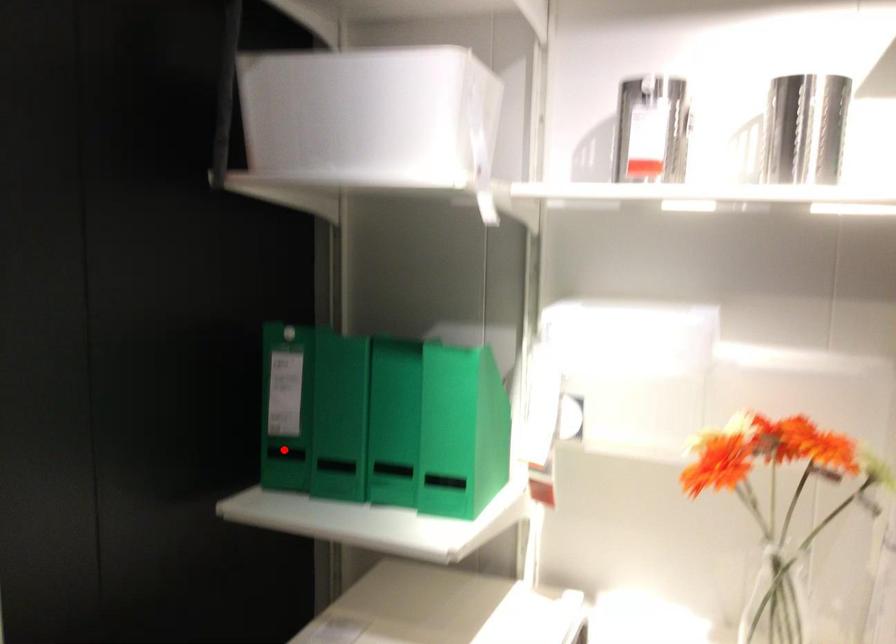
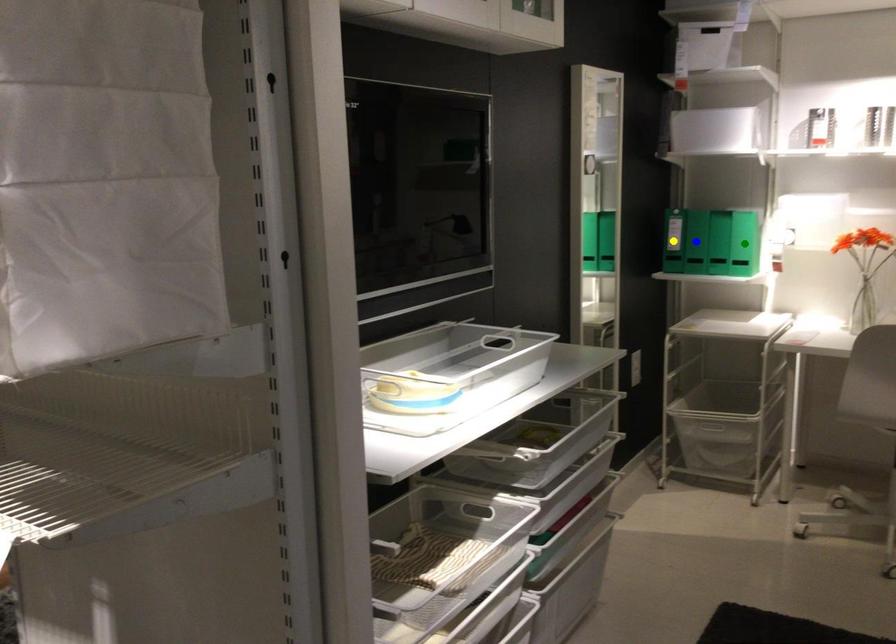
Question: I am providing you with two images of the same scene from different viewpoints. A red point is marked on the first image. You are given multiple points on the second image. Which point in image 2 is actually the same real-world point as the red point in image 1?

Choices:
 (A) green point
 (B) yellow point
 (C) blue point

Answer: (C)